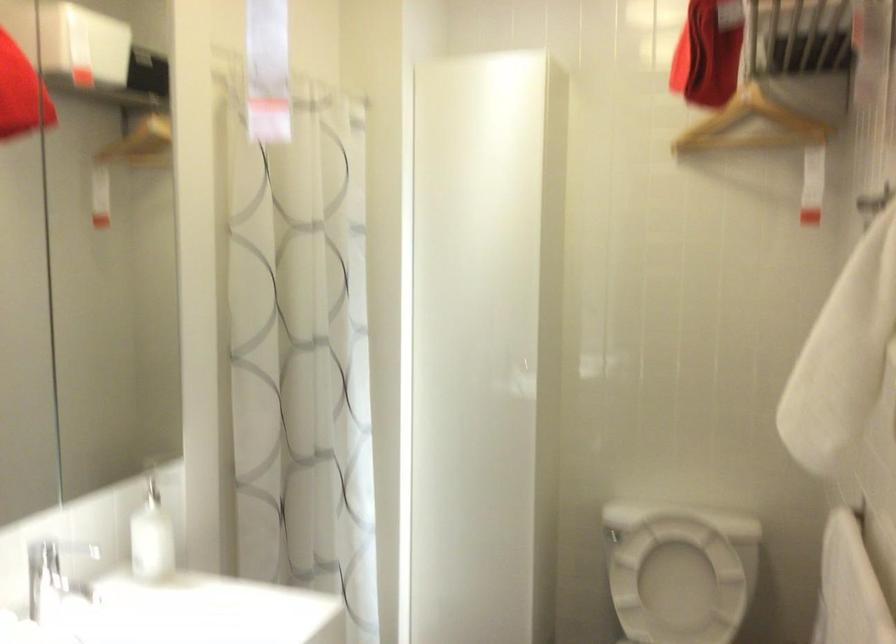
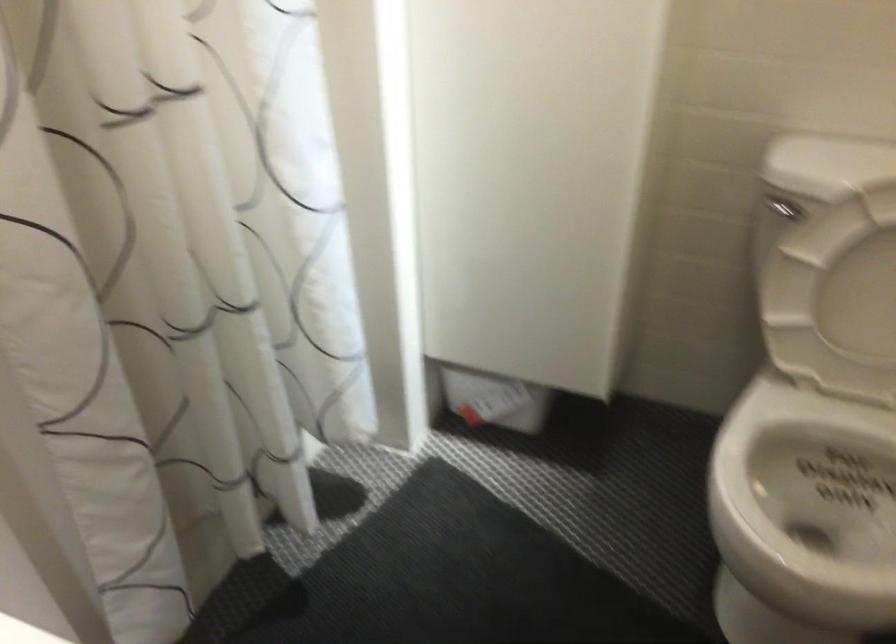
Where in the second image is the point corresponding to pixel 624 542 from the first image?

(782, 210)